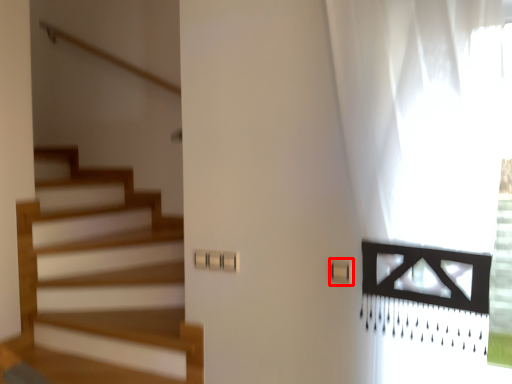
Question: From the image's perspective, what is the correct spatial relationship of light switch (annotated by the red box) in relation to curtain?

Choices:
 (A) above
 (B) below

Answer: (B)